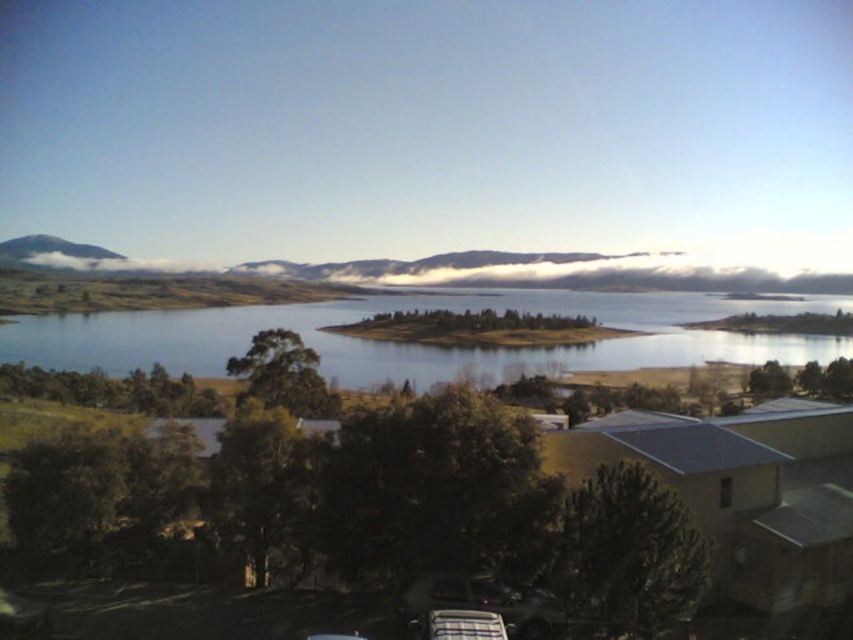
Question: Is white fluffy clouds at center bigger than smooth gray mountain at upper left?

Choices:
 (A) no
 (B) yes

Answer: (B)

Question: Which point is closer to the camera?

Choices:
 (A) (498, 628)
 (B) (758, 282)
 (C) (689, 332)

Answer: (A)

Question: Is clear blue water at center positioned before smooth gray mountain at upper left?

Choices:
 (A) no
 (B) yes

Answer: (B)

Question: Estimate the real-world distances between objects in this image. Which object is farther from the metallic silver car at lower center?

Choices:
 (A) white fluffy clouds at center
 (B) smooth gray mountain at upper left
 (C) clear blue water at center

Answer: (B)

Question: Among these points, which one is farthest from the camera?

Choices:
 (A) (393, 364)
 (B) (587, 275)
 (C) (463, 632)

Answer: (B)

Question: Does white fluffy clouds at center have a smaller size compared to metallic silver car at lower center?

Choices:
 (A) no
 (B) yes

Answer: (A)